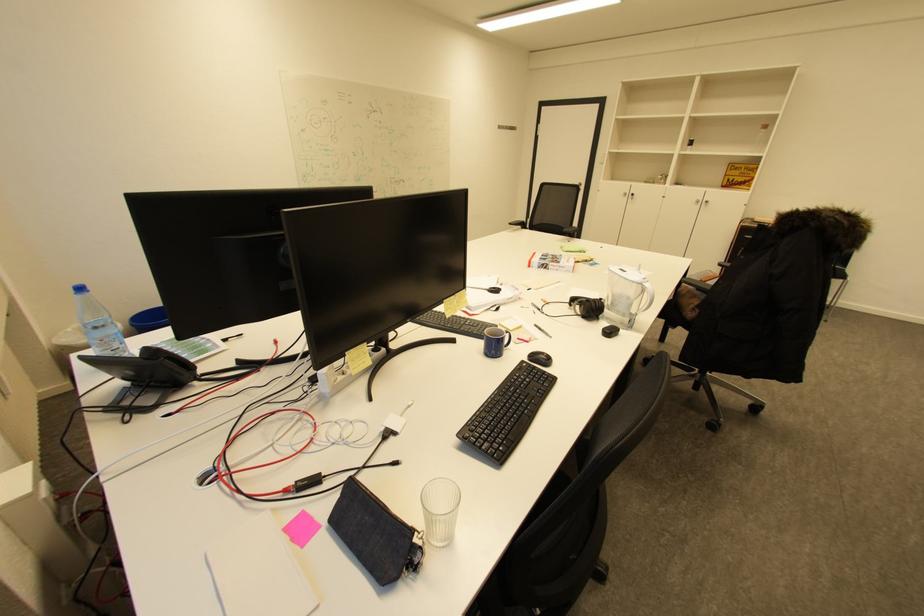
The width and height of the screenshot is (924, 616). Describe the element at coordinates (374, 533) in the screenshot. I see `the denim pouch` at that location.